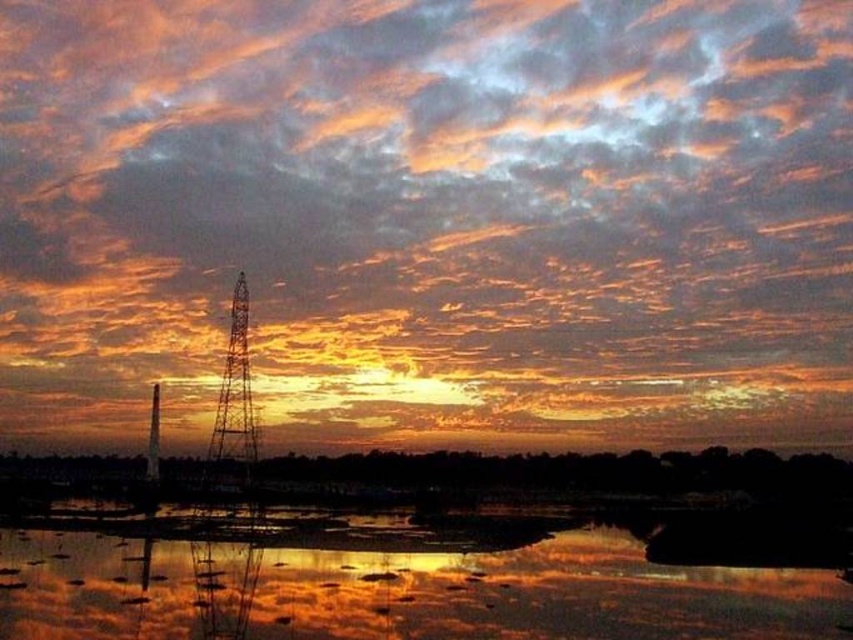
You are an artist trying to paint the sunset scene. You notice the orange matte cloud at upper center and the reflective water at center. Which object is located to the right of the other?

The orange matte cloud at upper center is positioned on the right side of reflective water at center.

You are an artist trying to paint the sunset scene. You notice the orange matte cloud at upper center and the reflective water at center. Which object in the scene has a taller vertical dimension?

The orange matte cloud at upper center has a greater height compared to the reflective water at center, so it has a taller vertical dimension.

You are a photographer trying to capture the sunset. You have two subjects in your viewfinder, the reflective water at center and the metallic wire tower at center. According to the scene, which object is positioned to the right of the other?

The reflective water at center is to the right of the metallic wire tower at center.